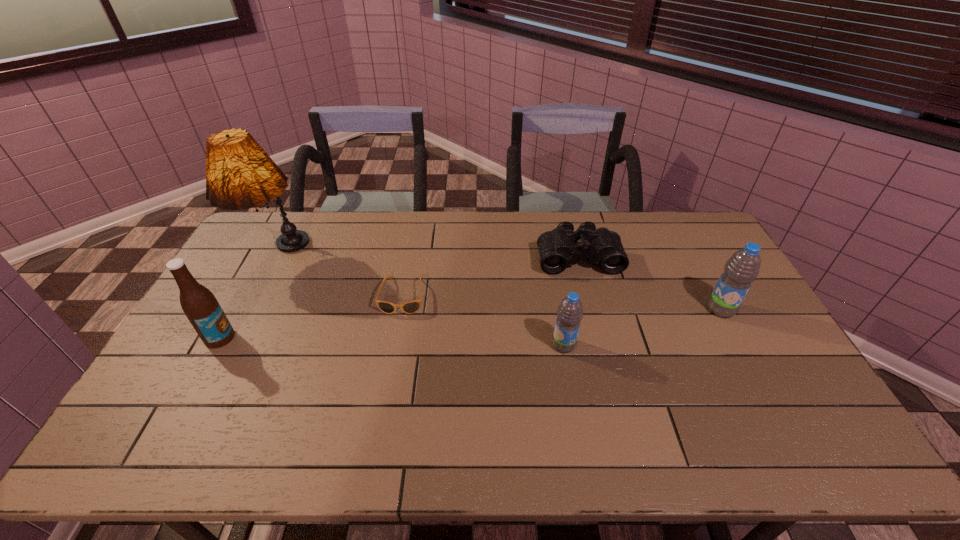
Given the evenly spaced water bottles in the image, where should an extra water bottle be added on the left to preserve the spacing? Please point to a vacant space. Please provide its 2D coordinates. Your answer should be formatted as a tuple, i.e. [(x, y)], where the tuple contains the x and y coordinates of a point satisfying the conditions above.

[(379, 387)]